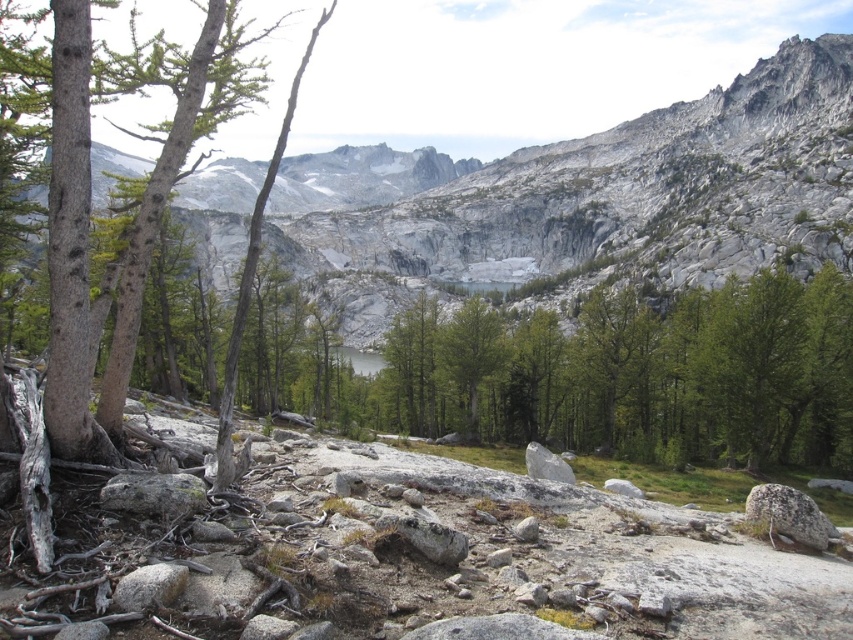
Question: Among these points, which one is nearest to the camera?

Choices:
 (A) (466, 300)
 (B) (347, 333)

Answer: (B)

Question: Is the position of gray rock mountain at center less distant than that of smooth gray bark tree at left?

Choices:
 (A) yes
 (B) no

Answer: (B)

Question: Is gray rock mountain at center behind smooth gray bark tree at left?

Choices:
 (A) no
 (B) yes

Answer: (B)

Question: Does gray rock mountain at center appear on the right side of smooth gray bark tree at left?

Choices:
 (A) no
 (B) yes

Answer: (B)

Question: Among these objects, which one is farthest from the camera?

Choices:
 (A) green matte tree at center
 (B) smooth gray bark tree at left
 (C) gray rock mountain at center

Answer: (A)

Question: Which of the following is the closest to the observer?

Choices:
 (A) (450, 344)
 (B) (59, 38)

Answer: (B)